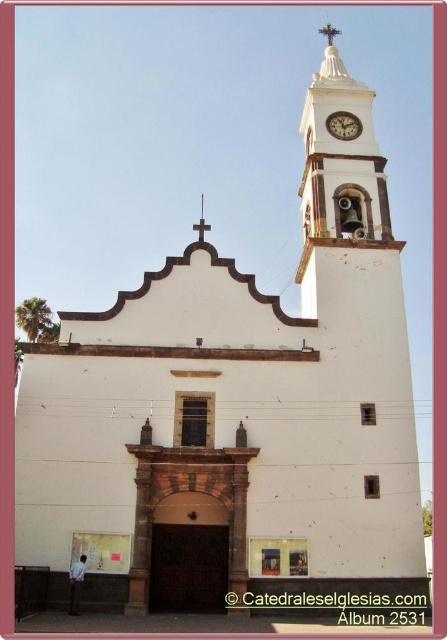
Can you confirm if white stucco clock tower at upper center is bigger than metallic cross at upper center?

Indeed, white stucco clock tower at upper center has a larger size compared to metallic cross at upper center.

Locate an element on the screen. This screenshot has height=640, width=447. white stucco clock tower at upper center is located at coordinates (340, 170).

Is point (329, 36) more distant than point (358, 132)?

Yes, point (329, 36) is farther from viewer.

Can you confirm if white stucco clock tower at upper center is thinner than metallic clock at upper center?

No, white stucco clock tower at upper center is not thinner than metallic clock at upper center.

Is point (358, 161) positioned in front of point (333, 115)?

Yes, point (358, 161) is in front of point (333, 115).

Find the location of `white stucco clock tower at upper center`. white stucco clock tower at upper center is located at coordinates (340, 170).

In the scene shown: Who is shorter, metallic clock at upper center or metallic cross at upper center?

metallic clock at upper center

Can you confirm if metallic clock at upper center is positioned above metallic cross at upper center?

Correct, metallic clock at upper center is located above metallic cross at upper center.

Who is more forward, (342, 120) or (202, 212)?

Positioned in front is point (342, 120).

At what (x,y) coordinates should I click in order to perform the action: click on metallic clock at upper center. Please return your answer as a coordinate pair (x, y). This screenshot has width=447, height=640. Looking at the image, I should click on (344, 125).